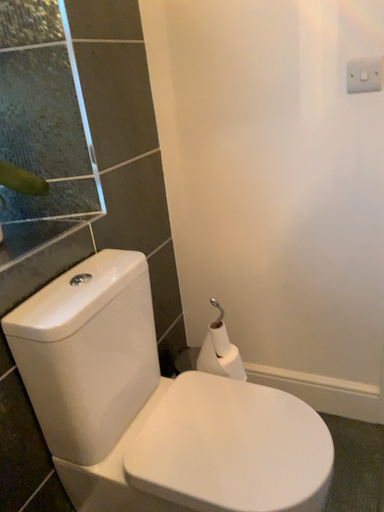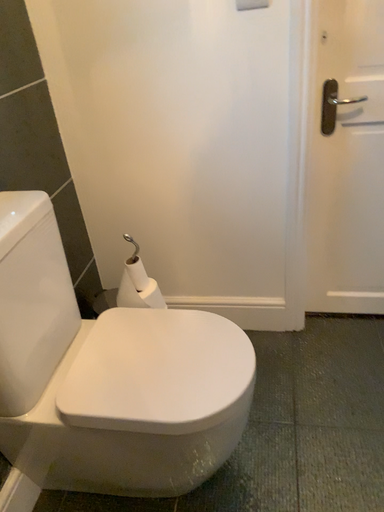
Question: How did the camera likely rotate when shooting the video?

Choices:
 (A) rotated upward
 (B) rotated downward

Answer: (B)